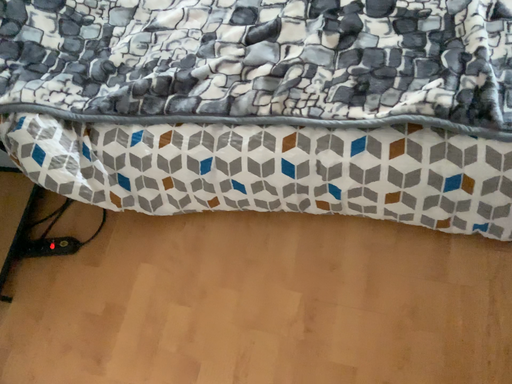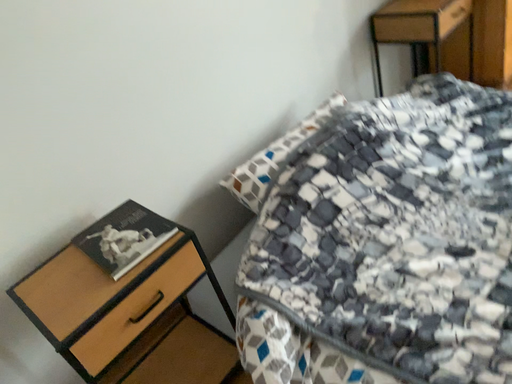
Question: How did the camera likely rotate when shooting the video?

Choices:
 (A) rotated left
 (B) rotated right

Answer: (A)